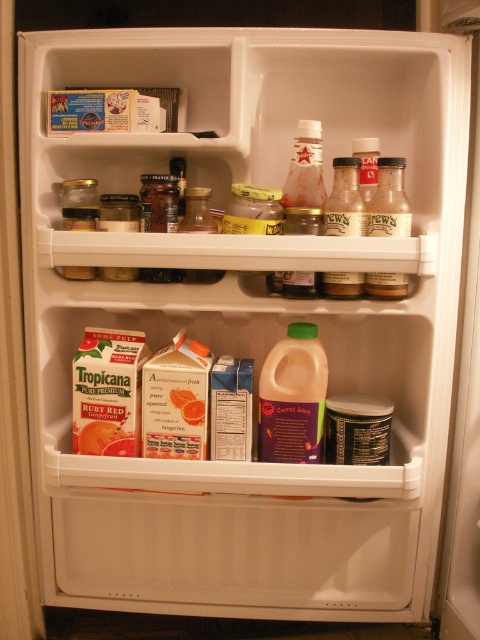
Is translucent plastic jar of carrot juice at lower center thinner than translucent glass bottle at upper right?

Incorrect, translucent plastic jar of carrot juice at lower center's width is not less than translucent glass bottle at upper right's.

Between translucent plastic jar of carrot juice at lower center and translucent glass bottle at upper right, which one appears on the left side from the viewer's perspective?

From the viewer's perspective, translucent plastic jar of carrot juice at lower center appears more on the left side.

Identify the location of translucent plastic jar of carrot juice at lower center. (292, 397).

Image resolution: width=480 pixels, height=640 pixels. Find the location of `translucent plastic jar of carrot juice at lower center`. translucent plastic jar of carrot juice at lower center is located at coordinates (292, 397).

Between translucent glass bottle at upper right and translucent glass bottle at center, which one appears on the left side from the viewer's perspective?

translucent glass bottle at center

Is point (395, 182) positioned before point (352, 278)?

No, it is behind (352, 278).

Describe the element at coordinates (389, 202) in the screenshot. I see `translucent glass bottle at upper right` at that location.

Locate an element on the screen. translucent glass bottle at upper right is located at coordinates (389, 202).

Is translucent plastic jar of carrot juice at lower center behind translucent glass bottle at center?

Yes.

Which is in front, point (308, 445) or point (357, 195)?

Positioned in front is point (357, 195).

The image size is (480, 640). In order to click on translucent plastic jar of carrot juice at lower center in this screenshot , I will do `click(292, 397)`.